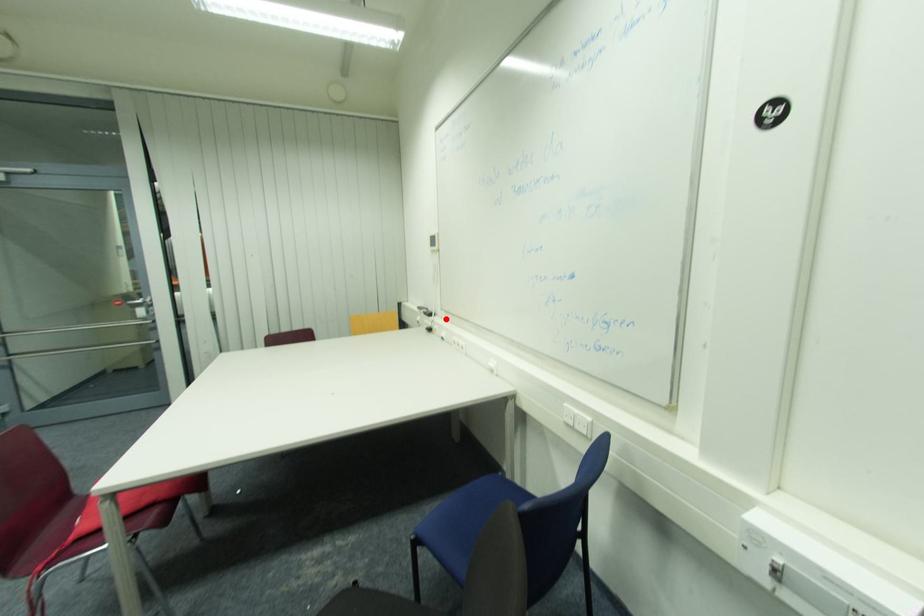
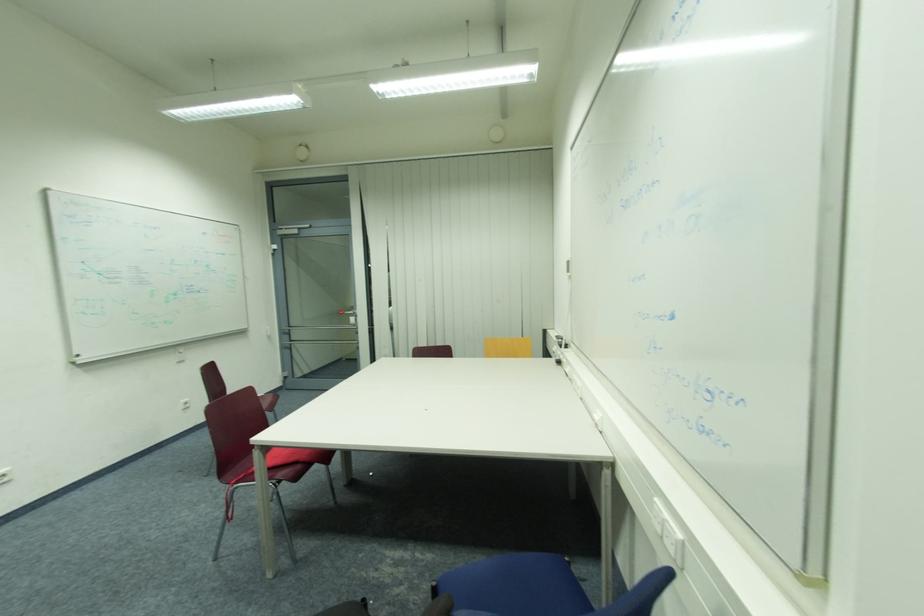
Question: I am providing you with two images of the same scene from different viewpoints. Given a red point in image1, look at the same physical point in image2. Is it:

Choices:
 (A) Closer to the viewpoint
 (B) Farther from the viewpoint

Answer: (A)